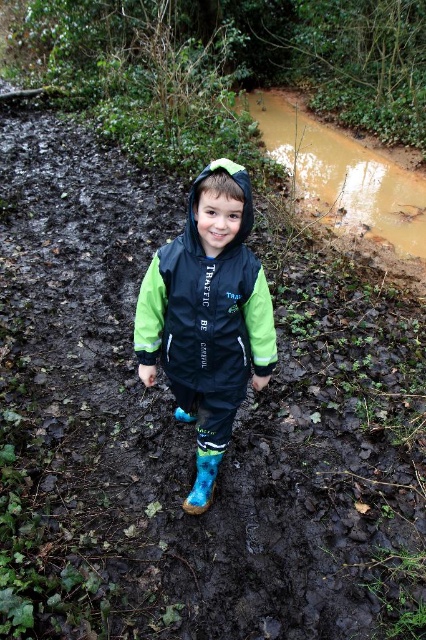
You are a delivery person carrying a box that is 2 meters long. You need to walk through a path that leads to the black matte jacket at center. Can you pass through without tilting the box sideways?

The distance between the black matte jacket at center and the viewer is 1.94 meters. Since the box is 2 meters long, you would need to tilt it sideways to pass through the path, as the available space is shorter than the box length.

You are a parent trying to dress your child for a muddy outdoor activity. You have a black matte jacket at center and a blue rubber boot at center. Which item should you put on first based on their sizes?

The black matte jacket at center is taller than the blue rubber boot at center, so you should put on the black matte jacket at center first to ensure it covers the body properly before putting on the blue rubber boot at center.